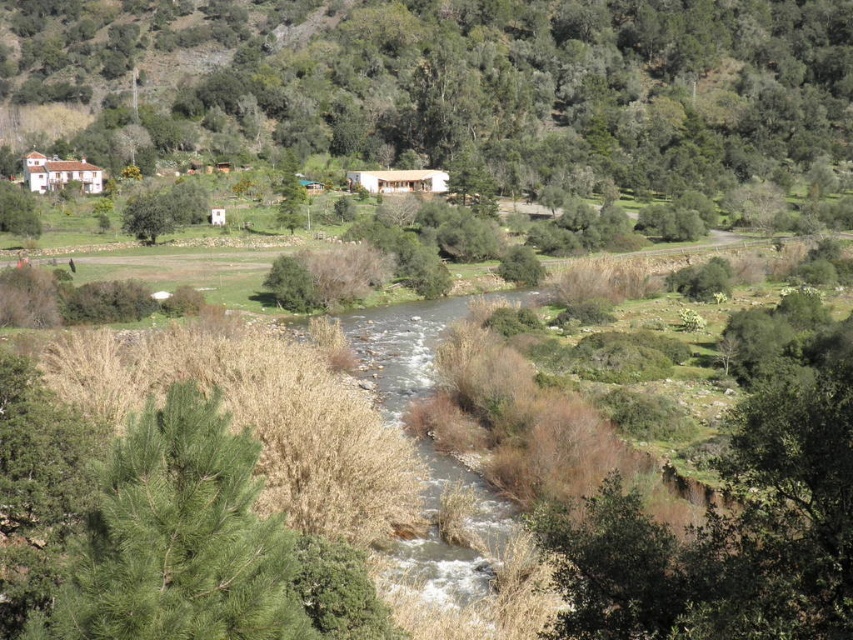
Question: Which object is farther from the camera taking this photo?

Choices:
 (A) green leafy tree at upper left
 (B) green leafy tree at center-left
 (C) green needle-like at lower left
 (D) green matte tree at upper left

Answer: (A)

Question: Can you confirm if brown grassy stream at center is smaller than green leafy tree at center-left?

Choices:
 (A) yes
 (B) no

Answer: (B)

Question: Which is nearer to the brown grassy stream at center?

Choices:
 (A) green matte tree at upper left
 (B) green leafy tree at upper left
 (C) green needle-like at lower left
 (D) green leafy tree at center-left

Answer: (C)

Question: Is green leafy tree at center-left to the right of green matte tree at center from the viewer's perspective?

Choices:
 (A) no
 (B) yes

Answer: (A)

Question: Does green leafy tree at upper left have a smaller size compared to green matte tree at upper left?

Choices:
 (A) no
 (B) yes

Answer: (A)

Question: Estimate the real-world distances between objects in this image. Which object is closer to the green matte tree at center?

Choices:
 (A) green leafy tree at center-left
 (B) brown grassy stream at center

Answer: (A)